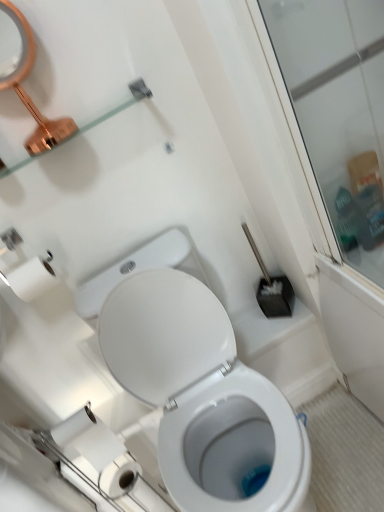
In order to face white glossy bidet at lower center, should I rotate leftwards or rightwards?

To face it directly, rotate right by 3.593 degrees.

Find the location of a particular element. white glossy bidet at lower center is located at coordinates (233, 445).

What do you see at coordinates (24, 77) in the screenshot?
I see `copper metallic mirror at upper left` at bounding box center [24, 77].

Where is `white paper at lower left`? The width and height of the screenshot is (384, 512). white paper at lower left is located at coordinates (89, 438).

Who is taller, white paper at lower left or white glossy bidet at lower center?

white paper at lower left is taller.

Looking at this image, is white glossy bidet at lower center at the back of white paper at lower left?

No, white paper at lower left is not facing the opposite direction of white glossy bidet at lower center.

Is white paper at lower left wider or thinner than white glossy bidet at lower center?

In the image, white paper at lower left appears to be wider than white glossy bidet at lower center.

From the picture: Considering their positions, is white paper at lower left located in front of or behind white glossy bidet at lower center?

white paper at lower left is positioned closer to the viewer than white glossy bidet at lower center.

From a real-world perspective, which object rests below the other?

white glossy toilet at center.

How different are the orientations of white glossy toilet at center and clear glass shelf at upper left in degrees?

white glossy toilet at center and clear glass shelf at upper left are facing 1.19 degrees away from each other.

Which is behind, white glossy toilet at center or clear glass shelf at upper left?

clear glass shelf at upper left is behind.

Is white paper at lower left to the left or to the right of white glossy toilet at center in the image?

Based on their positions, white paper at lower left is located to the left of white glossy toilet at center.

In the image, is white paper at lower left positioned in front of or behind white glossy toilet at center?

Clearly, white paper at lower left is behind white glossy toilet at center.

Considering the points (80, 446) and (265, 402), which point is behind, point (80, 446) or point (265, 402)?

Point (80, 446)

Is white glossy bidet at lower center situated inside copper metallic mirror at upper left or outside?

The correct answer is: outside.

Is white glossy bidet at lower center looking in the opposite direction of copper metallic mirror at upper left?

No, white glossy bidet at lower center's orientation is not away from copper metallic mirror at upper left.

Considering the relative positions of white glossy bidet at lower center and copper metallic mirror at upper left in the image provided, is white glossy bidet at lower center to the left of copper metallic mirror at upper left from the viewer's perspective?

No, white glossy bidet at lower center is not to the left of copper metallic mirror at upper left.

Is point (276, 457) closer to viewer compared to point (20, 24)?

No.

What are the coordinates of `mirror that appears behind the white glossy toilet at center` in the screenshot? It's located at (24, 77).

Which object is wider, white glossy toilet at center or copper metallic mirror at upper left?

white glossy toilet at center.

In the scene shown: Is white glossy toilet at center surrounding copper metallic mirror at upper left?

No, copper metallic mirror at upper left is not inside white glossy toilet at center.

Can you tell me how much copper metallic mirror at upper left and white paper at lower left differ in facing direction?

The facing directions of copper metallic mirror at upper left and white paper at lower left are 0.791 degrees apart.

Which is further, (x=3, y=68) or (x=106, y=456)?

The point (x=106, y=456) is farther.

Is copper metallic mirror at upper left turned away from white paper at lower left?

No, white paper at lower left is not at the back of copper metallic mirror at upper left.

From the image's perspective, is copper metallic mirror at upper left positioned above or below white paper at lower left?

From the image's perspective, copper metallic mirror at upper left appears above white paper at lower left.

Can you tell me how much clear glass shelf at upper left and white glossy bidet at lower center differ in facing direction?

The angular difference between clear glass shelf at upper left and white glossy bidet at lower center is 1.14 degrees.

Consider the image. Is clear glass shelf at upper left at the left side of white glossy bidet at lower center?

Yes, clear glass shelf at upper left is to the left of white glossy bidet at lower center.

Could you tell me if clear glass shelf at upper left is turned towards white glossy bidet at lower center?

No, clear glass shelf at upper left is not aimed at white glossy bidet at lower center.

Identify the location of balustrade in front of the white glossy bidet at lower center. The image size is (384, 512). (117, 106).

You are a GUI agent. You are given a task and a screenshot of the screen. Output one action in this format:
    pyautogui.click(x=<x>, y=<y>)
    Task: Click on the bidet that appears below the white paper at lower left (from the image's perspective)
    
    Given the screenshot: What is the action you would take?
    tap(233, 445)

I want to click on balustrade above the white glossy toilet at center (from a real-world perspective), so click(x=117, y=106).

Estimate the real-world distances between objects in this image. Which object is further from clear glass shelf at upper left, copper metallic mirror at upper left or white glossy bidet at lower center?

white glossy bidet at lower center is positioned further to the anchor clear glass shelf at upper left.

Looking at the image, which one is located further to white glossy toilet at center, copper metallic mirror at upper left or clear glass shelf at upper left?

The object further to white glossy toilet at center is clear glass shelf at upper left.

Based on their spatial positions, is clear glass shelf at upper left or white glossy bidet at lower center further from copper metallic mirror at upper left?

white glossy bidet at lower center is further to copper metallic mirror at upper left.

Which object lies further to the anchor point copper metallic mirror at upper left, white paper at lower left or clear glass shelf at upper left?

Based on the image, white paper at lower left appears to be further to copper metallic mirror at upper left.

Looking at the image, which one is located closer to copper metallic mirror at upper left, white glossy toilet at center or white glossy bidet at lower center?

Among the two, white glossy toilet at center is located nearer to copper metallic mirror at upper left.

Which object lies nearer to the anchor point clear glass shelf at upper left, white paper at lower left or white glossy bidet at lower center?

white paper at lower left lies closer to clear glass shelf at upper left than the other object.

Based on their spatial positions, is white glossy bidet at lower center or copper metallic mirror at upper left closer to white paper at lower left?

white glossy bidet at lower center is positioned closer to the anchor white paper at lower left.

Which object lies further to the anchor point white glossy bidet at lower center, white paper at lower left or copper metallic mirror at upper left?

copper metallic mirror at upper left lies further to white glossy bidet at lower center than the other object.

Where is `toilet paper between clear glass shelf at upper left and white glossy bidet at lower center in the up-down direction`? toilet paper between clear glass shelf at upper left and white glossy bidet at lower center in the up-down direction is located at coordinates (89, 438).

Locate an element on the screen. The width and height of the screenshot is (384, 512). toilet paper between copper metallic mirror at upper left and white glossy bidet at lower center in the vertical direction is located at coordinates (89, 438).

Find the location of a particular element. Image resolution: width=384 pixels, height=512 pixels. toilet between clear glass shelf at upper left and white glossy bidet at lower center from top to bottom is located at coordinates (202, 395).

Where is `balustrade between copper metallic mirror at upper left and white glossy toilet at center from top to bottom`? This screenshot has width=384, height=512. balustrade between copper metallic mirror at upper left and white glossy toilet at center from top to bottom is located at coordinates (117, 106).